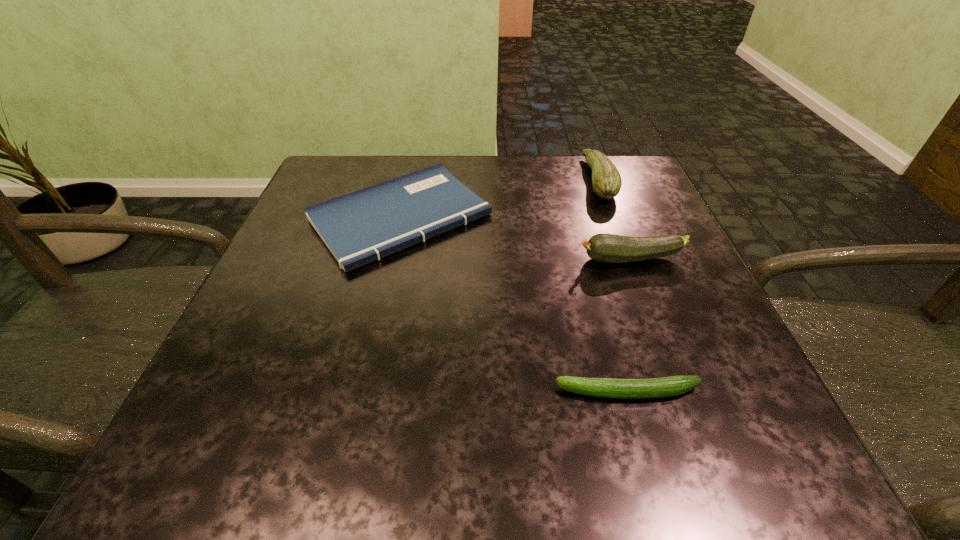
Identify the location of the farthest zucchini. This screenshot has width=960, height=540. (606, 180).

This screenshot has height=540, width=960. What are the coordinates of `the second farthest zucchini` in the screenshot? It's located at (607, 248).

Locate an element on the screen. paperback book is located at coordinates (363, 226).

Where is `the shortest zucchini`? the shortest zucchini is located at coordinates (673, 385).

Locate an element on the screen. This screenshot has height=540, width=960. the nearest zucchini is located at coordinates (673, 385).

This screenshot has width=960, height=540. In order to click on free space located at the stem end of the farthest zucchini in this screenshot , I will do `click(542, 179)`.

Where is `free space located 0.070m at the stem end of the farthest zucchini`? The height and width of the screenshot is (540, 960). free space located 0.070m at the stem end of the farthest zucchini is located at coordinates (555, 179).

The width and height of the screenshot is (960, 540). In order to click on free space located at the stem end of the farthest zucchini in this screenshot , I will do `click(542, 179)`.

You are a GUI agent. You are given a task and a screenshot of the screen. Output one action in this format:
    pyautogui.click(x=<x>, y=<y>)
    Task: Click on the free location located 0.360m at the blossom end of the second nearest zucchini
    
    Given the screenshot: What is the action you would take?
    pyautogui.click(x=383, y=259)

Identify the location of free spot located at the blossom end of the second nearest zucchini. Image resolution: width=960 pixels, height=540 pixels. (447, 259).